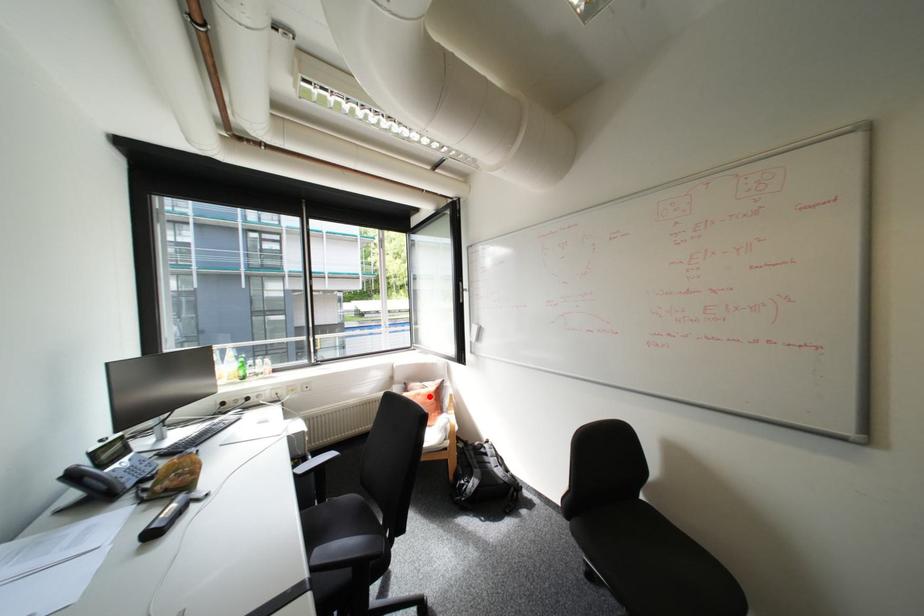
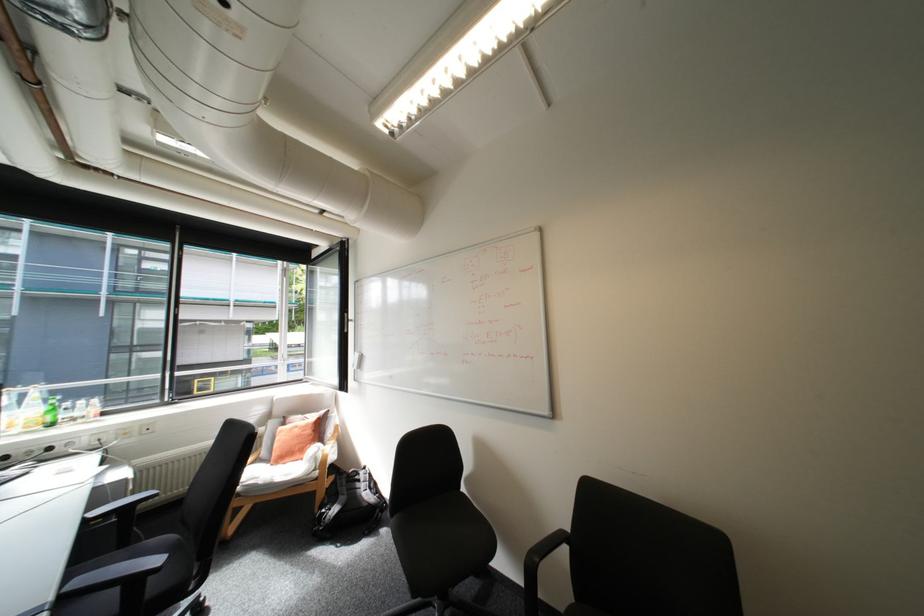
Find the pixel in the second image that matches the highlighted location in the first image.

(307, 429)